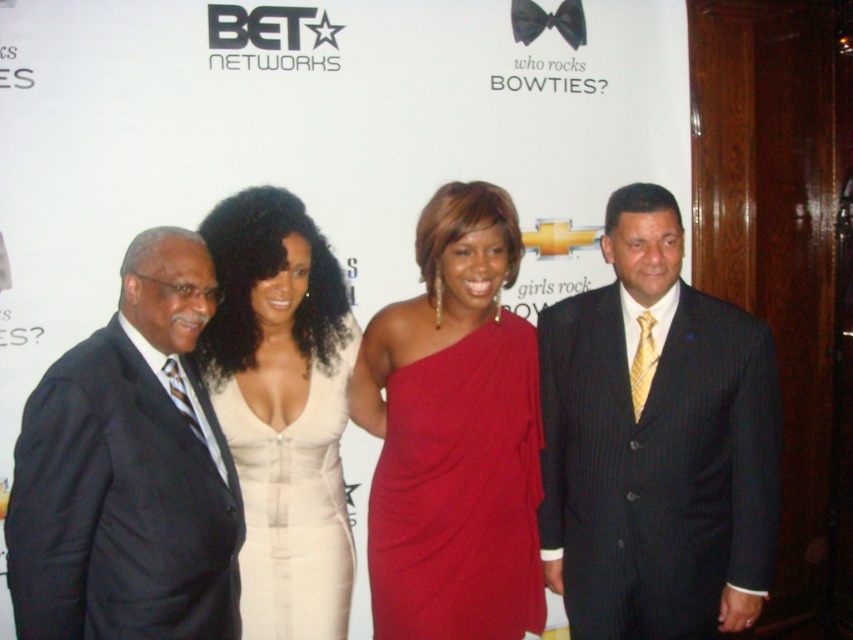
The image size is (853, 640). Describe the element at coordinates (656, 442) in the screenshot. I see `dark blue pinstripe suit at center` at that location.

The image size is (853, 640). What are the coordinates of `dark blue pinstripe suit at center` in the screenshot? It's located at (656, 442).

Which is behind, point (196, 593) or point (254, 577)?

Point (254, 577)

What do you see at coordinates (128, 472) in the screenshot?
I see `dark blue suit at left` at bounding box center [128, 472].

I want to click on dark blue suit at left, so click(128, 472).

In the scene shown: Between satin red dress at center and white satin dress at center, which one is positioned higher?

satin red dress at center

Which is more to the right, satin red dress at center or white satin dress at center?

satin red dress at center

Who is more distant from viewer, (498, 202) or (285, 474)?

The point (285, 474) is more distant.

This screenshot has height=640, width=853. In order to click on satin red dress at center in this screenshot , I will do `click(454, 435)`.